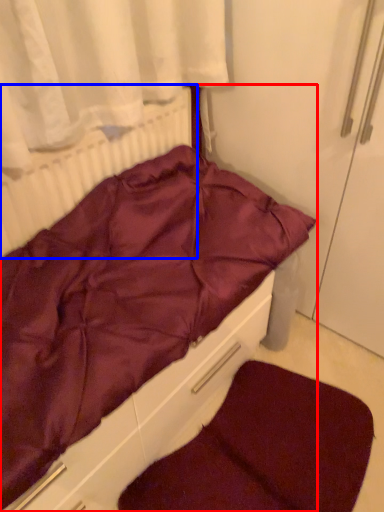
Question: Which point is closer to the camera, furniture (highlighted by a red box) or radiator (highlighted by a blue box)?

Choices:
 (A) furniture
 (B) radiator

Answer: (A)